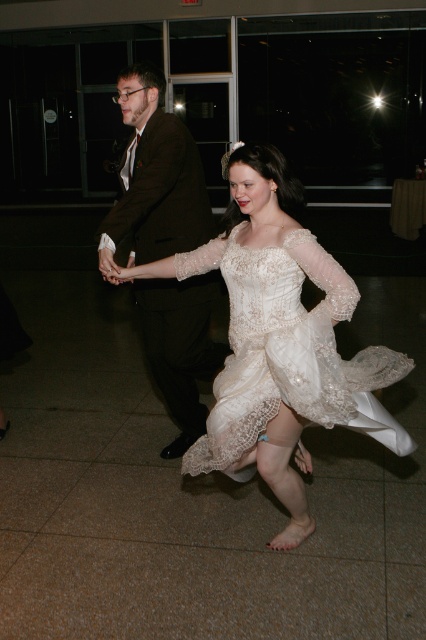
From the picture: You are a photographer at the event and need to capture a full body shot of both the ivory lace dress at center and the dark brown suit at center. Which one might require you to adjust your camera angle to ensure the entire outfit is visible?

The ivory lace dress at center is shorter than the dark brown suit at center, so you might need to adjust your camera angle to ensure the entire ivory lace dress at center is visible.

Looking at this image, you are a photographer at the dance event and want to focus on both the point at (256, 444) and the point at (287, 294). Which point is closer to your camera lens?

Point (287, 294) is closer to the camera lens because it is less further than point (256, 444).